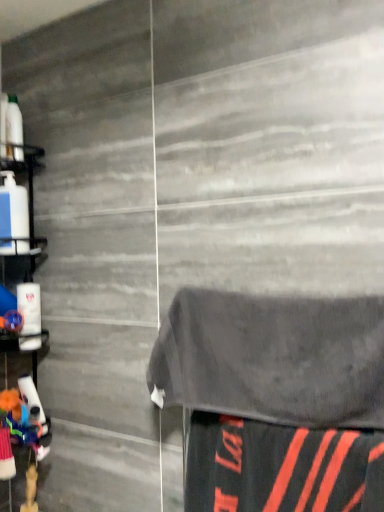
Question: From the image's perspective, is dark gray towel at center under white plastic shelf at left?

Choices:
 (A) yes
 (B) no

Answer: (A)

Question: Does dark gray towel at center have a greater width compared to white plastic shelf at left?

Choices:
 (A) no
 (B) yes

Answer: (A)

Question: Is white plastic shelf at left completely or partially inside dark gray towel at center?

Choices:
 (A) yes
 (B) no

Answer: (B)

Question: From a real-world perspective, is dark gray towel at center physically below white plastic shelf at left?

Choices:
 (A) yes
 (B) no

Answer: (A)

Question: Does dark gray towel at center have a larger size compared to white plastic shelf at left?

Choices:
 (A) yes
 (B) no

Answer: (B)

Question: From a real-world perspective, relative to black matte fabric at lower right, is dark gray towel at center vertically above or below?

Choices:
 (A) above
 (B) below

Answer: (A)

Question: Would you say dark gray towel at center is inside or outside black matte fabric at lower right?

Choices:
 (A) inside
 (B) outside

Answer: (B)

Question: Is dark gray towel at center taller or shorter than black matte fabric at lower right?

Choices:
 (A) short
 (B) tall

Answer: (B)

Question: Looking at the image, does dark gray towel at center seem bigger or smaller compared to black matte fabric at lower right?

Choices:
 (A) big
 (B) small

Answer: (A)

Question: From a real-world perspective, is black matte fabric at lower right positioned above or below white plastic shelf at left?

Choices:
 (A) above
 (B) below

Answer: (B)

Question: Is black matte fabric at lower right taller or shorter than white plastic shelf at left?

Choices:
 (A) tall
 (B) short

Answer: (B)

Question: Does point (236, 480) appear closer or farther from the camera than point (31, 273)?

Choices:
 (A) farther
 (B) closer

Answer: (B)

Question: Is black matte fabric at lower right spatially inside white plastic shelf at left, or outside of it?

Choices:
 (A) inside
 (B) outside

Answer: (B)

Question: Visually, is white plastic shelf at left positioned to the left or to the right of black matte fabric at lower right?

Choices:
 (A) left
 (B) right

Answer: (A)

Question: Is white plastic shelf at left situated inside black matte fabric at lower right or outside?

Choices:
 (A) inside
 (B) outside

Answer: (B)